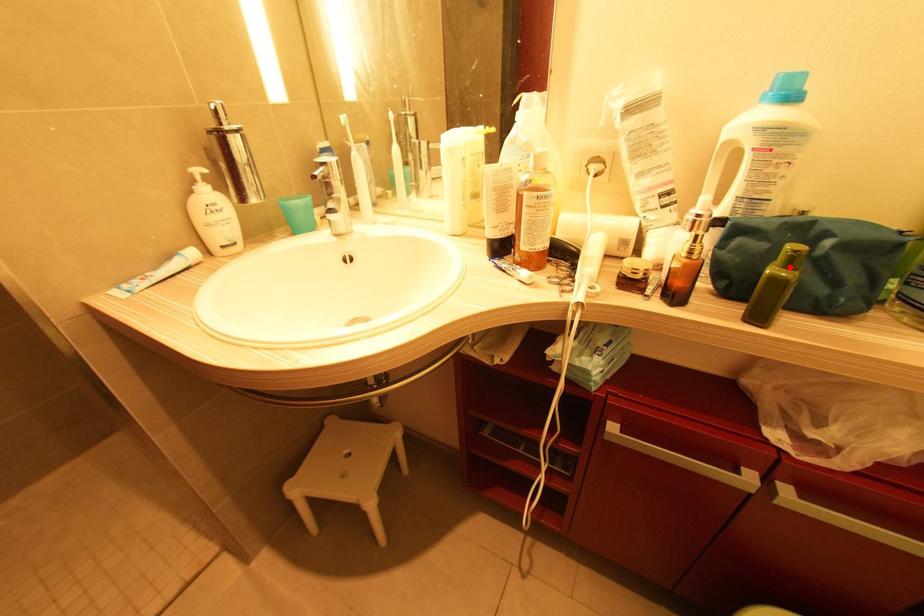
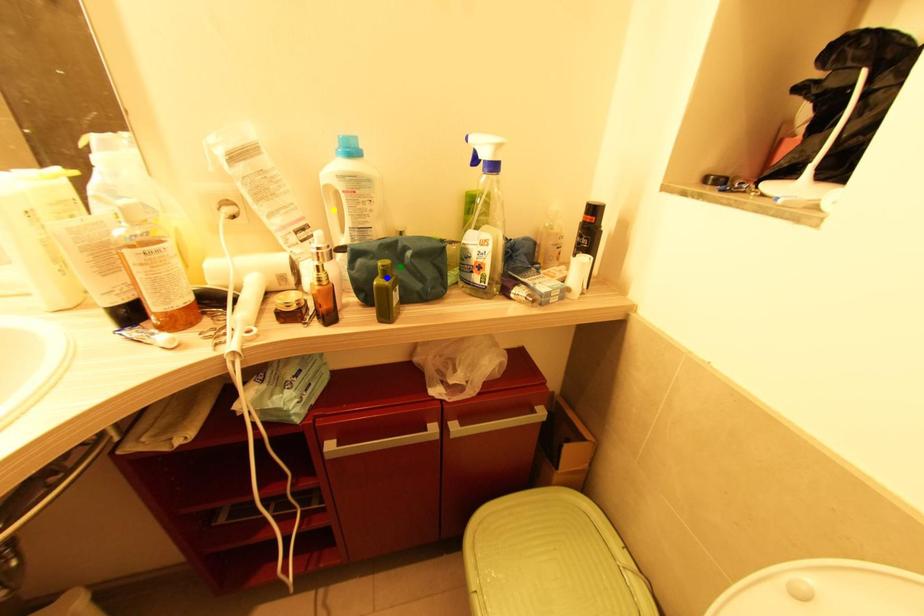
Question: I am providing you with two images of the same scene from different viewpoints. A red point is marked on the first image. You are given multiple points on the second image. Can you choose the point in image 2 that corresponds to the point in image 1?

Choices:
 (A) blue point
 (B) yellow point
 (C) green point

Answer: (A)